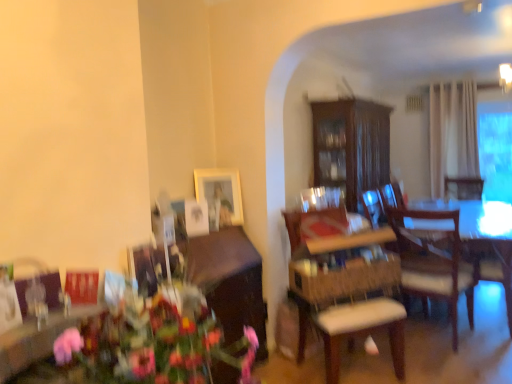
The image size is (512, 384). Identify the location of vacant space in front of wooden armchair at right. (483, 338).